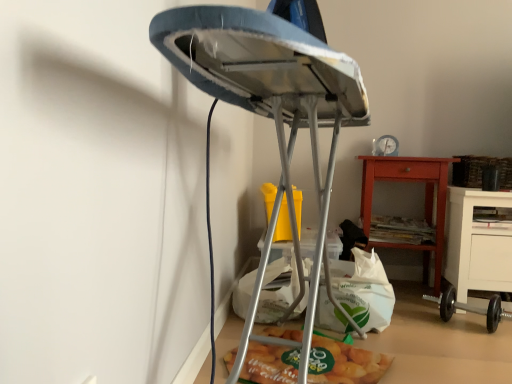
Locate an element on the screen. vacant space that's between white paper bag at lower center and black rubber dumbbell at lower right is located at coordinates (439, 334).